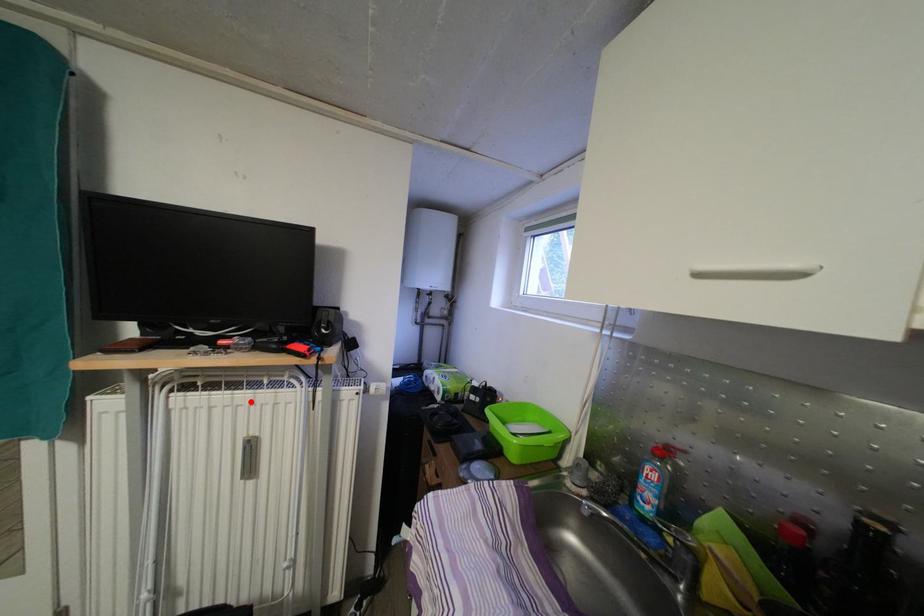
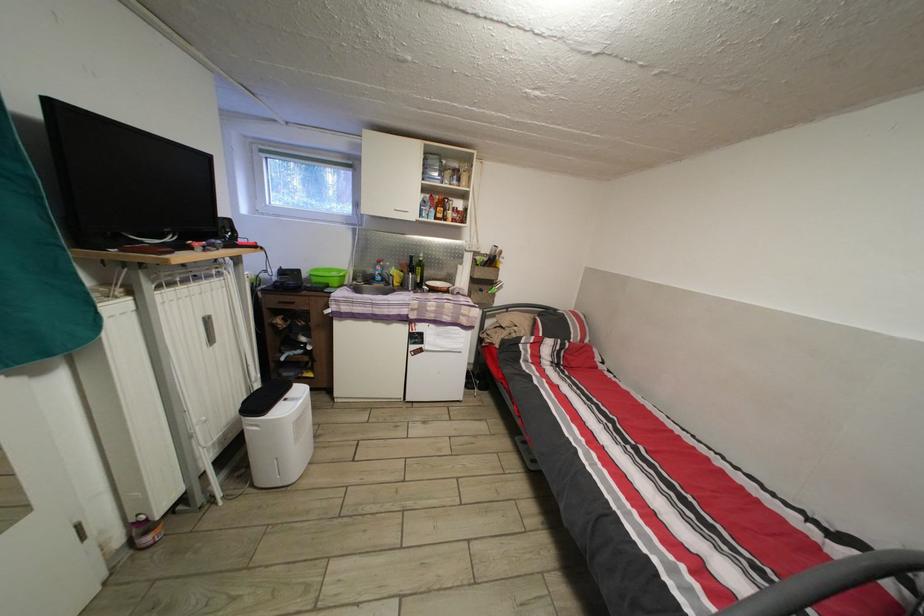
The point at the highlighted location is marked in the first image. Where is the corresponding point in the second image?

(201, 294)